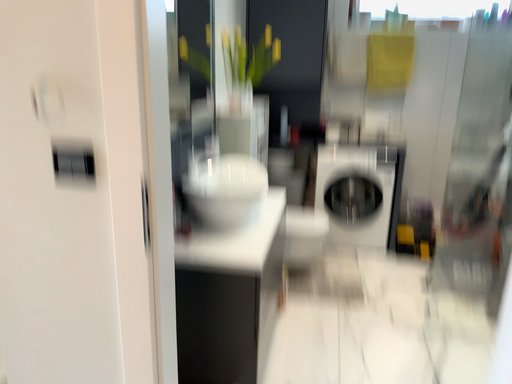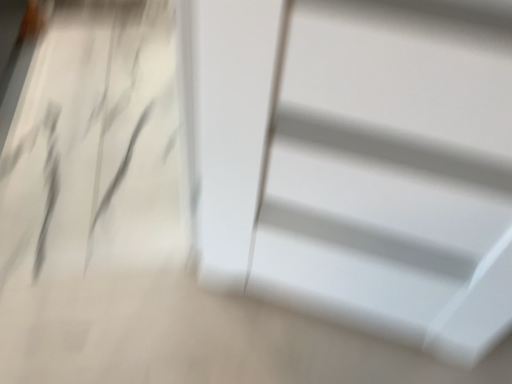
Question: Which way did the camera rotate in the video?

Choices:
 (A) rotated right
 (B) rotated left

Answer: (A)